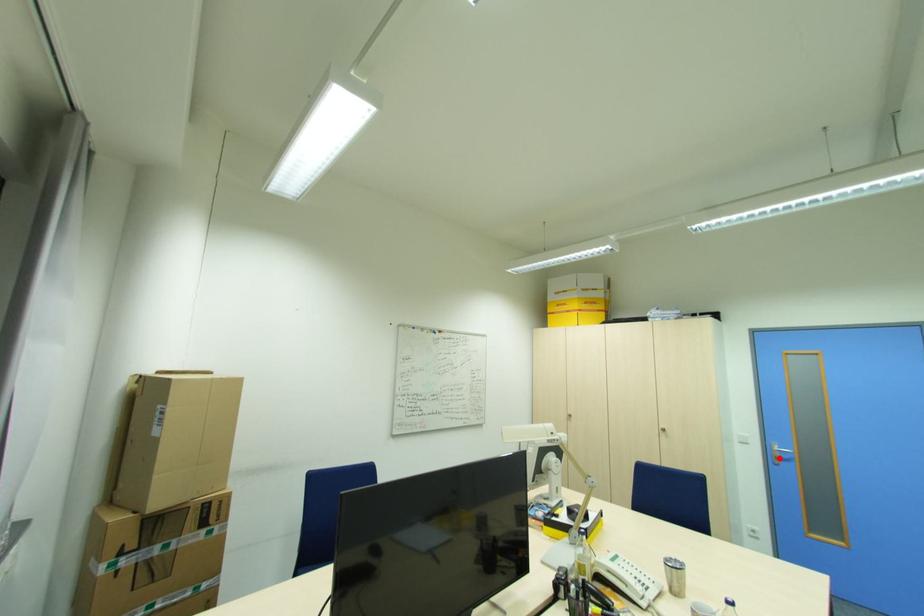
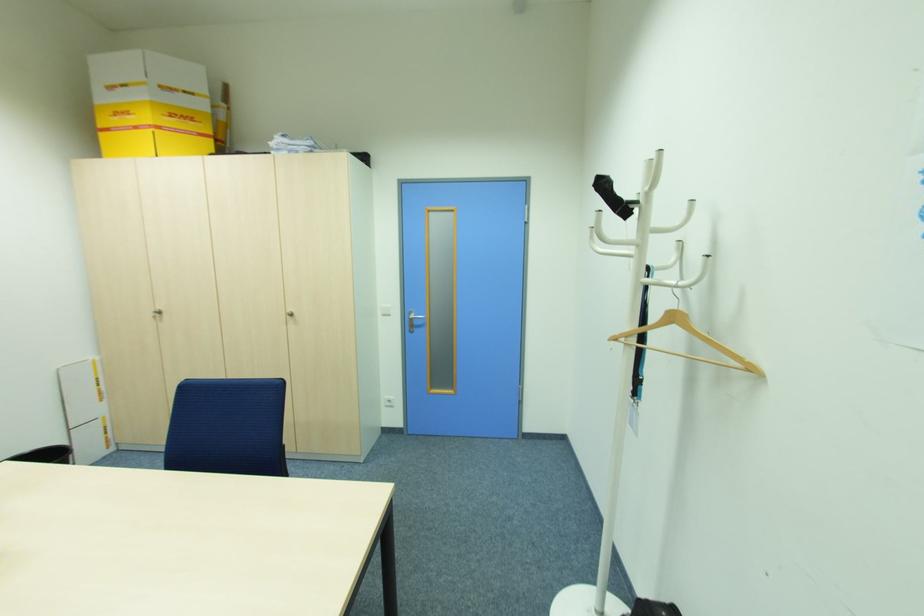
Question: I am providing you with two images of the same scene from different viewpoints. Image1 has a red point marked. In image2, the corresponding 3D location appears at what relative position? Reply with the corresponding letter.

Choices:
 (A) Closer
 (B) Farther

Answer: (B)